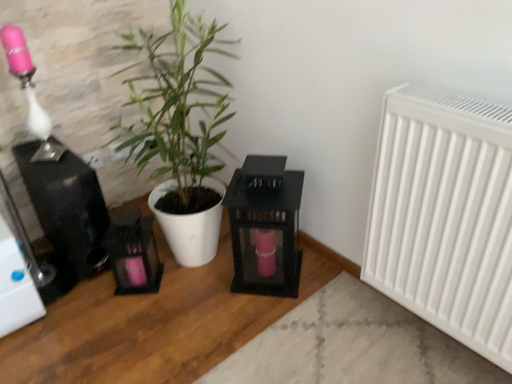
Find the location of a particular element. free area below white matte radiator at right (from a real-world perspective) is located at coordinates (425, 340).